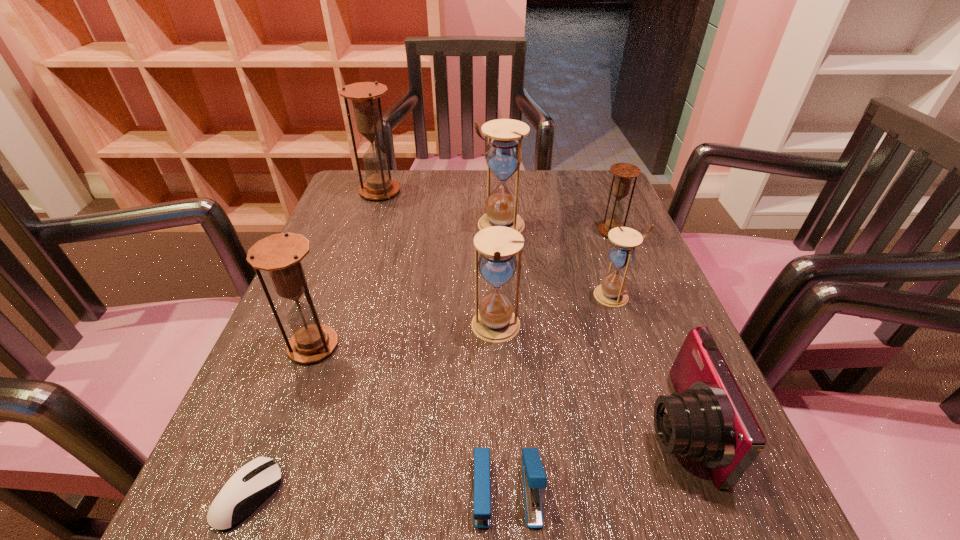
Where is `vacant region that satisfies the following two spatial constraints: 1. on the back side of the farthest white hourglass; 2. on the right side of the mouse`? vacant region that satisfies the following two spatial constraints: 1. on the back side of the farthest white hourglass; 2. on the right side of the mouse is located at coordinates (352, 225).